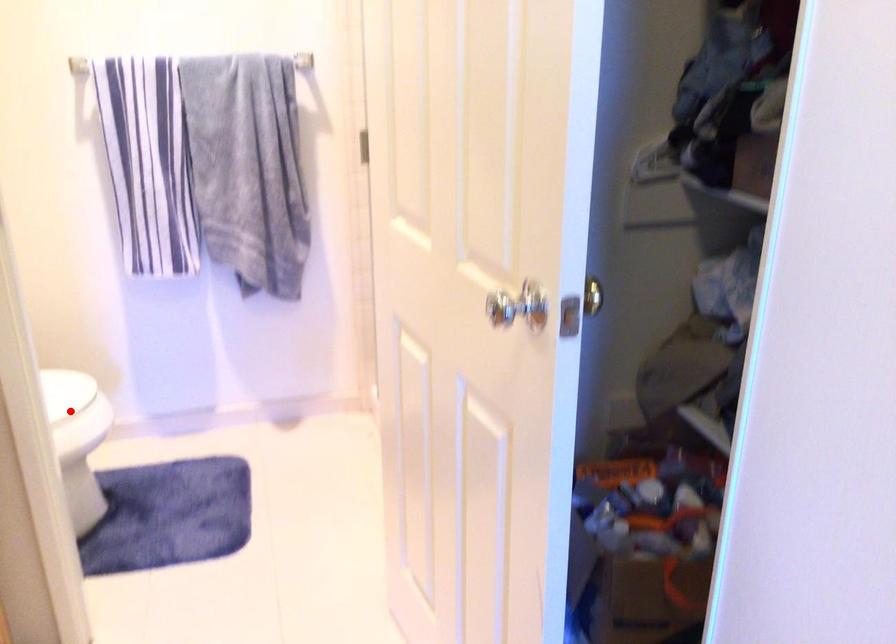
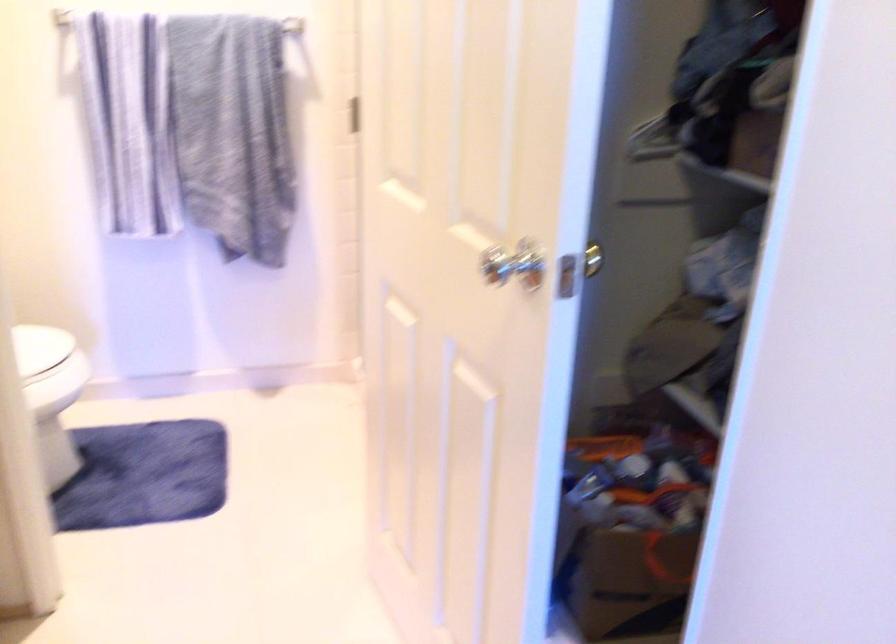
The point at the highlighted location is marked in the first image. Where is the corresponding point in the second image?

(45, 368)